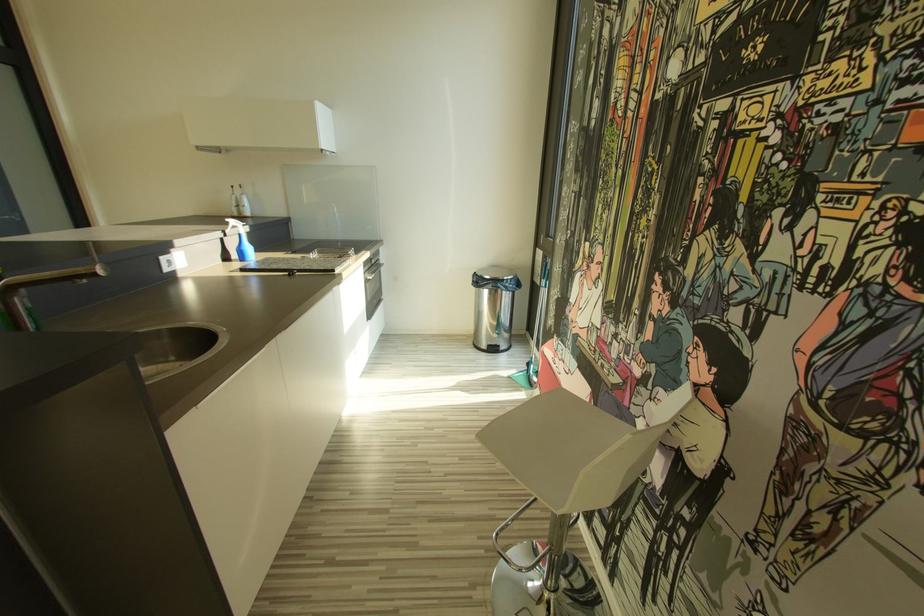
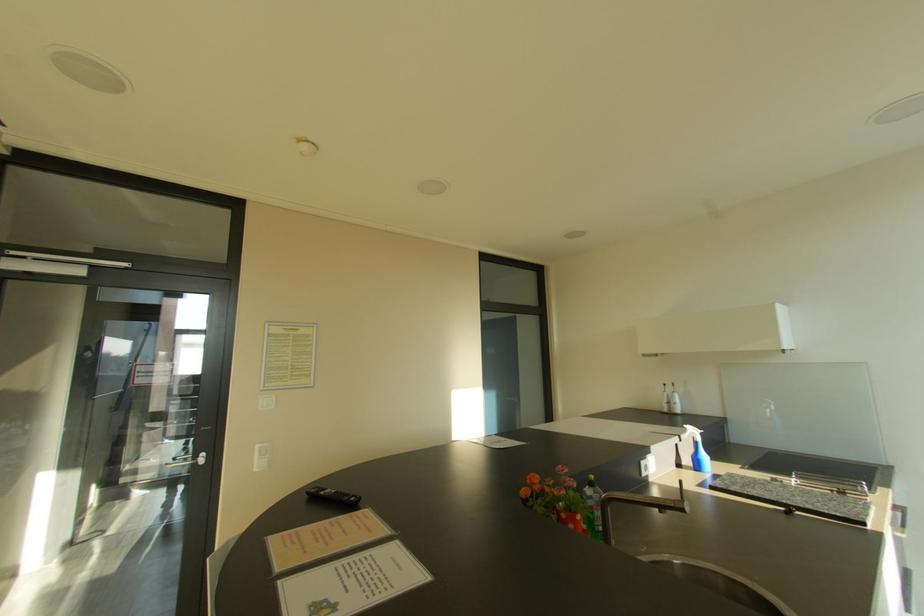
Based on the continuous images, in which direction is the camera rotating?

The rotation direction of the camera is left-up.